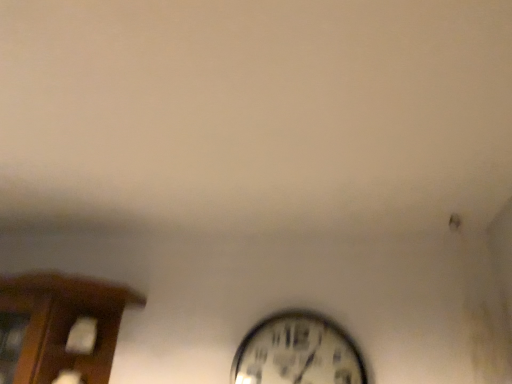
What is the approximate height of brown wood cabinet at left?

brown wood cabinet at left is 39.98 centimeters in height.

Where is `brown wood cabinet at left`? The height and width of the screenshot is (384, 512). brown wood cabinet at left is located at coordinates (64, 323).

The height and width of the screenshot is (384, 512). What do you see at coordinates (64, 323) in the screenshot?
I see `brown wood cabinet at left` at bounding box center [64, 323].

Describe the element at coordinates (297, 352) in the screenshot. Image resolution: width=512 pixels, height=384 pixels. I see `metallic silver clock at lower center` at that location.

Locate an element on the screen. This screenshot has width=512, height=384. metallic silver clock at lower center is located at coordinates (297, 352).

I want to click on brown wood cabinet at left, so click(x=64, y=323).

Can you confirm if brown wood cabinet at left is positioned to the left of metallic silver clock at lower center?

Yes.

Considering the positions of objects brown wood cabinet at left and metallic silver clock at lower center in the image provided, who is in front, brown wood cabinet at left or metallic silver clock at lower center?

Positioned in front is brown wood cabinet at left.

Is point (49, 279) closer to viewer compared to point (266, 353)?

Yes, it is.

From the image's perspective, would you say brown wood cabinet at left is positioned over metallic silver clock at lower center?

Yes, from the image's perspective, brown wood cabinet at left is on top of metallic silver clock at lower center.

From a real-world perspective, is brown wood cabinet at left physically above metallic silver clock at lower center?

Actually, brown wood cabinet at left is physically below metallic silver clock at lower center in the real world.

Considering the relative sizes of brown wood cabinet at left and metallic silver clock at lower center in the image provided, is brown wood cabinet at left thinner than metallic silver clock at lower center?

Incorrect, the width of brown wood cabinet at left is not less than that of metallic silver clock at lower center.

Can you confirm if brown wood cabinet at left is shorter than metallic silver clock at lower center?

No.

Does brown wood cabinet at left have a larger size compared to metallic silver clock at lower center?

Yes.

In the scene shown: Is brown wood cabinet at left situated inside metallic silver clock at lower center or outside?

brown wood cabinet at left is outside metallic silver clock at lower center.

Based on the photo, is brown wood cabinet at left next to metallic silver clock at lower center?

No, brown wood cabinet at left is not in contact with metallic silver clock at lower center.

In the scene shown: Is metallic silver clock at lower center at the back of brown wood cabinet at left?

No, brown wood cabinet at left is not facing away from metallic silver clock at lower center.

You are a GUI agent. You are given a task and a screenshot of the screen. Output one action in this format:
    pyautogui.click(x=<x>, y=<y>)
    Task: Click on the furniture above the metallic silver clock at lower center (from the image's perspective)
    
    Given the screenshot: What is the action you would take?
    pyautogui.click(x=64, y=323)

Is metallic silver clock at lower center to the right of brown wood cabinet at left from the viewer's perspective?

Yes.

Considering the relative positions of metallic silver clock at lower center and brown wood cabinet at left in the image provided, is metallic silver clock at lower center behind brown wood cabinet at left?

Yes, the depth of metallic silver clock at lower center is greater than that of brown wood cabinet at left.

Is point (250, 361) farther from viewer compared to point (21, 282)?

Yes.

From the image's perspective, is metallic silver clock at lower center located beneath brown wood cabinet at left?

Yes.

From a real-world perspective, which is physically below, metallic silver clock at lower center or brown wood cabinet at left?

In real-world perspective, brown wood cabinet at left is lower.

In terms of width, does metallic silver clock at lower center look wider or thinner when compared to brown wood cabinet at left?

Clearly, metallic silver clock at lower center has less width compared to brown wood cabinet at left.

Is metallic silver clock at lower center taller than brown wood cabinet at left?

Incorrect, the height of metallic silver clock at lower center is not larger of that of brown wood cabinet at left.

Can you confirm if metallic silver clock at lower center is smaller than brown wood cabinet at left?

Yes, metallic silver clock at lower center is smaller than brown wood cabinet at left.

Is brown wood cabinet at left located within metallic silver clock at lower center?

No.

Is metallic silver clock at lower center next to brown wood cabinet at left and touching it?

No, metallic silver clock at lower center is not beside brown wood cabinet at left.

Is metallic silver clock at lower center aimed at brown wood cabinet at left?

No, metallic silver clock at lower center is not turned towards brown wood cabinet at left.

Where is `furniture that is above the metallic silver clock at lower center (from the image's perspective)`? This screenshot has width=512, height=384. furniture that is above the metallic silver clock at lower center (from the image's perspective) is located at coordinates (64, 323).

Identify the location of wall clock that is behind the brown wood cabinet at left. (297, 352).

In the image, there is a brown wood cabinet at left. Where is `wall clock below it (from the image's perspective)`? The height and width of the screenshot is (384, 512). wall clock below it (from the image's perspective) is located at coordinates pos(297,352).